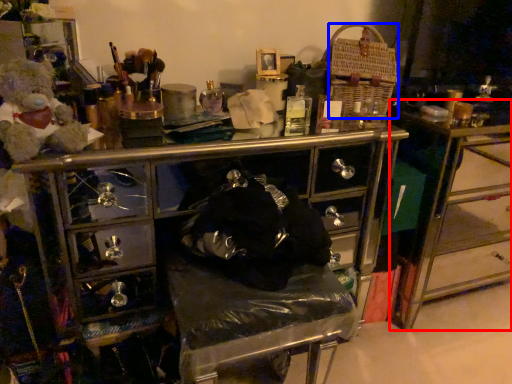
Question: Which of the following is the farthest to the observer, table (highlighted by a red box) or crate (highlighted by a blue box)?

Choices:
 (A) table
 (B) crate

Answer: (A)